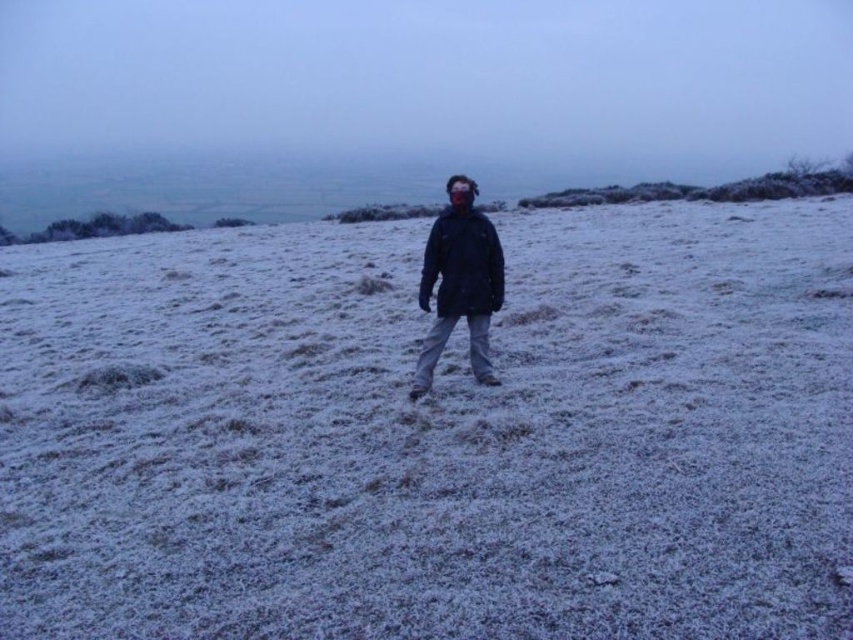
Question: Is frosted grass at center bigger than matte black jacket at center?

Choices:
 (A) yes
 (B) no

Answer: (A)

Question: Which object appears closest to the camera in this image?

Choices:
 (A) frosted grass at center
 (B) matte black jacket at center
 (C) dark blue matte jacket at center

Answer: (A)

Question: Which of the following is the farthest from the observer?

Choices:
 (A) (660, 205)
 (B) (447, 280)
 (C) (477, 298)

Answer: (A)

Question: Does matte black jacket at center appear under dark blue matte jacket at center?

Choices:
 (A) yes
 (B) no

Answer: (A)

Question: Is frosted grass at center positioned before dark blue matte jacket at center?

Choices:
 (A) no
 (B) yes

Answer: (B)

Question: Based on their relative distances, which object is farther from the frosted grass at center?

Choices:
 (A) dark blue matte jacket at center
 (B) matte black jacket at center

Answer: (B)